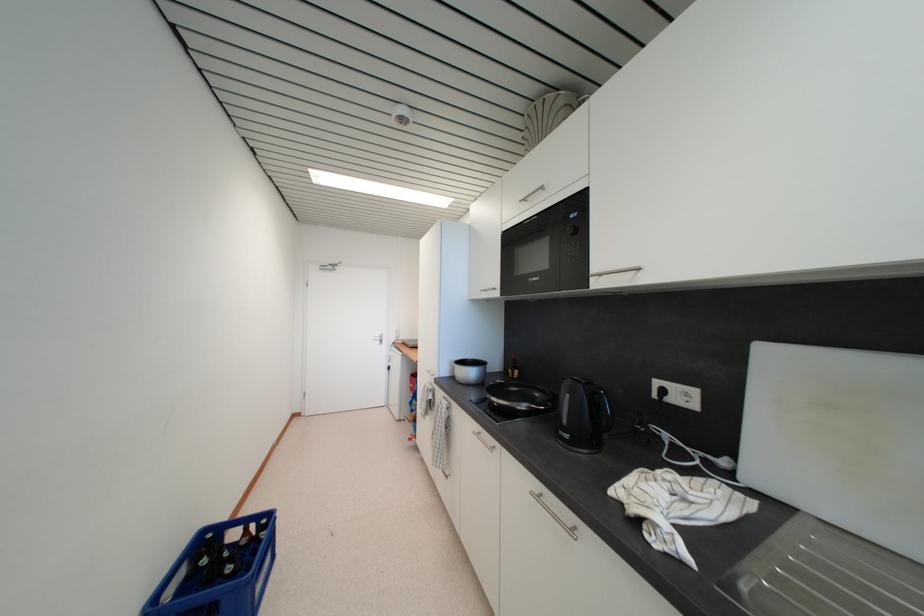
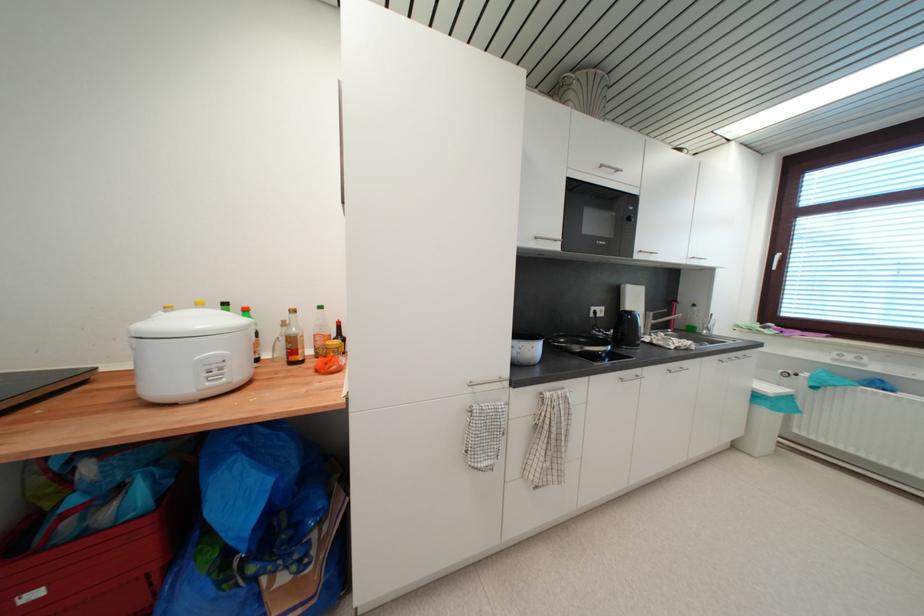
Find the pixel in the second image that matches (660,398) in the first image.

(597, 317)